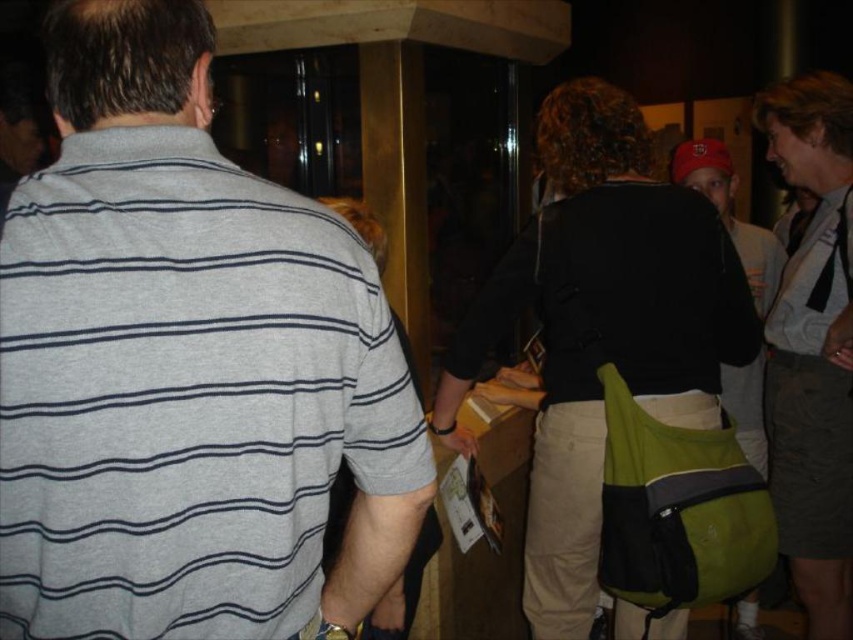
In the scene shown: Can you confirm if gray striped shirt at left is smaller than green fabric backpack at center?

Indeed, gray striped shirt at left has a smaller size compared to green fabric backpack at center.

Describe the element at coordinates (186, 368) in the screenshot. Image resolution: width=853 pixels, height=640 pixels. I see `gray striped shirt at left` at that location.

I want to click on gray striped shirt at left, so click(186, 368).